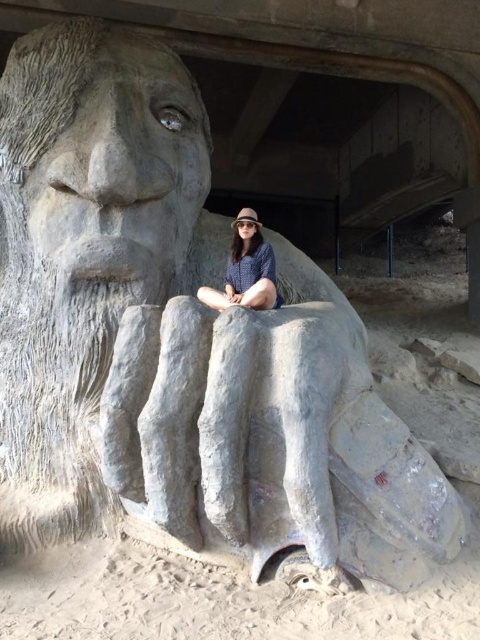
Question: Which of the following is the farthest from the observer?

Choices:
 (A) (78, 65)
 (B) (250, 298)

Answer: (A)

Question: Observing the image, what is the correct spatial positioning of gray stone head at upper left in reference to matte gray stone statue at lower center?

Choices:
 (A) left
 (B) right

Answer: (A)

Question: Which point is farther to the camera?

Choices:
 (A) matte gray stone statue at lower center
 (B) gray stone head at upper left

Answer: (B)

Question: Does gray stone head at upper left have a larger size compared to matte gray stone statue at lower center?

Choices:
 (A) yes
 (B) no

Answer: (A)

Question: Which of the following is the closest to the observer?

Choices:
 (A) matte gray stone statue at lower center
 (B) gray stone head at upper left

Answer: (A)

Question: From the image, what is the correct spatial relationship of gray stone head at upper left in relation to matte gray stone statue at lower center?

Choices:
 (A) right
 (B) left

Answer: (B)